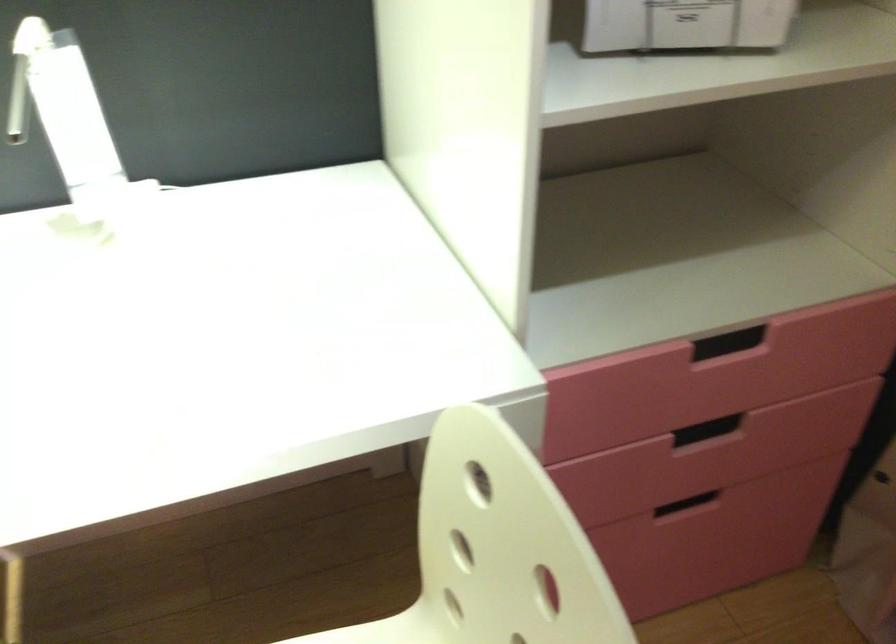
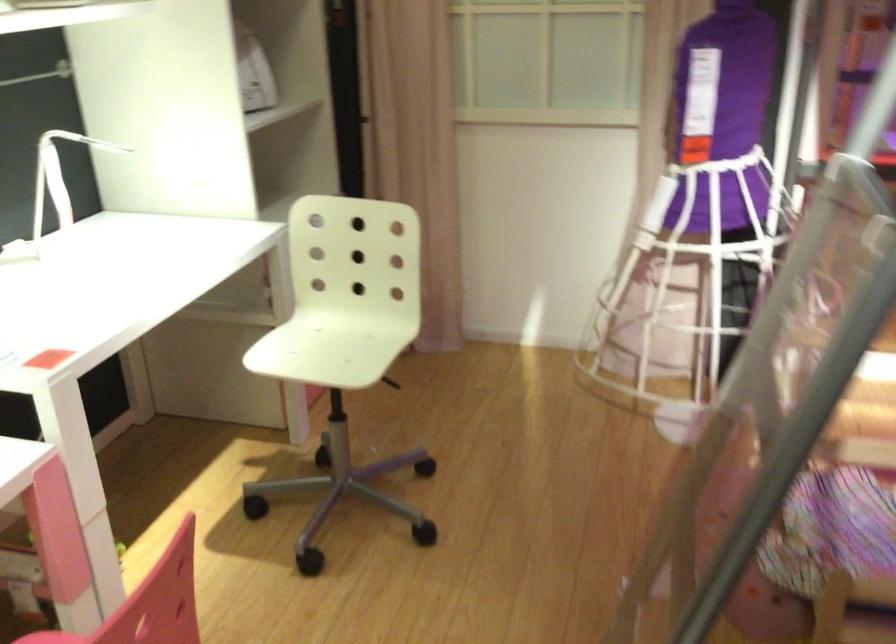
Question: I am providing you with two images of the same scene from different viewpoints. Please identify which objects are invisible in image2.

Choices:
 (A) black camera tripod
 (B) white chair sitting surface
 (C) recessed drawer handle
 (D) white desk lamp

Answer: (C)